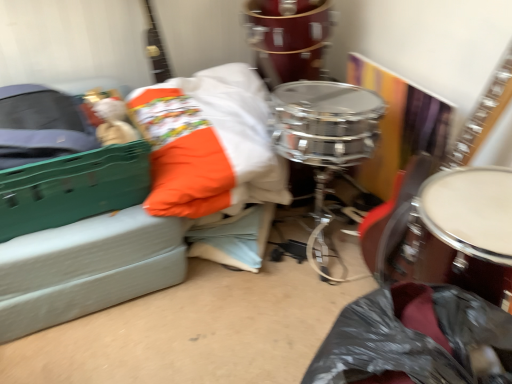
Describe the element at coordinates (458, 233) in the screenshot. I see `shiny brown drum at right, placed as the 1th drum when sorted from front to back` at that location.

This screenshot has width=512, height=384. I want to click on glossy wood guitar at upper left, the 2th guitar when ordered from right to left, so click(156, 48).

The image size is (512, 384). I want to click on shiny brown drum at right, acting as the 2th drum starting from the top, so click(458, 233).

From the image's perspective, is glossy wood guitar at upper left, the 2th guitar when ordered from right to left, positioned above or below shiny brown drum at right, the 1th drum from the bottom?

glossy wood guitar at upper left, the 2th guitar when ordered from right to left, is above shiny brown drum at right, the 1th drum from the bottom.

Considering the positions of objects glossy wood guitar at upper left, acting as the 1th guitar starting from the left, and shiny brown drum at right, placed as the 1th drum when sorted from front to back, in the image provided, who is more to the right, glossy wood guitar at upper left, acting as the 1th guitar starting from the left, or shiny brown drum at right, placed as the 1th drum when sorted from front to back,?

From the viewer's perspective, shiny brown drum at right, placed as the 1th drum when sorted from front to back, appears more on the right side.

Between glossy wood guitar at upper left, acting as the 1th guitar starting from the left, and shiny brown drum at right, the 1th drum from the bottom, which one has less height?

glossy wood guitar at upper left, acting as the 1th guitar starting from the left, is shorter.

Does point (157, 59) come closer to viewer compared to point (417, 224)?

That is False.

Is glossy wood guitar at upper left, the 2th guitar when ordered from right to left, with shiny chrome drum at center, which is the first drum in top-to-bottom order?

glossy wood guitar at upper left, the 2th guitar when ordered from right to left, and shiny chrome drum at center, which is the first drum in top-to-bottom order, are clearly separated.

Which point is more forward, (153, 68) or (291, 34)?

Point (291, 34)

Is glossy wood guitar at upper left, acting as the 1th guitar starting from the left, inside the boundaries of shiny chrome drum at center, placed as the 2th drum when sorted from front to back, or outside?

glossy wood guitar at upper left, acting as the 1th guitar starting from the left, is located beyond the bounds of shiny chrome drum at center, placed as the 2th drum when sorted from front to back.

Is wooden acoustic guitar at center right, which is counted as the 1th guitar, starting from the right, wider than shiny brown drum at right, the 1th drum from the bottom?

Incorrect, the width of wooden acoustic guitar at center right, which is counted as the 1th guitar, starting from the right, does not surpass that of shiny brown drum at right, the 1th drum from the bottom.

Does point (374, 262) lie behind point (498, 227)?

Yes, point (374, 262) is farther from viewer.

Is wooden acoustic guitar at center right, which is counted as the 1th guitar, starting from the right, turned away from shiny brown drum at right, the 1th drum from the bottom?

No, shiny brown drum at right, the 1th drum from the bottom, is not at the back of wooden acoustic guitar at center right, which is counted as the 1th guitar, starting from the right.

Is wooden acoustic guitar at center right, the 2th guitar positioned from the left, oriented away from shiny chrome drum at center, which is the first drum in top-to-bottom order?

No, wooden acoustic guitar at center right, the 2th guitar positioned from the left, is not facing the opposite direction of shiny chrome drum at center, which is the first drum in top-to-bottom order.

Considering the relative positions of wooden acoustic guitar at center right, which is counted as the 1th guitar, starting from the right, and shiny chrome drum at center, which is the second drum in bottom-to-top order, in the image provided, is wooden acoustic guitar at center right, which is counted as the 1th guitar, starting from the right, to the right of shiny chrome drum at center, which is the second drum in bottom-to-top order, from the viewer's perspective?

Indeed, wooden acoustic guitar at center right, which is counted as the 1th guitar, starting from the right, is positioned on the right side of shiny chrome drum at center, which is the second drum in bottom-to-top order.

How many degrees apart are the facing directions of wooden acoustic guitar at center right, the 2th guitar positioned from the left, and shiny chrome drum at center, which is the second drum in bottom-to-top order?

There is a 3.02-degree angle between the facing directions of wooden acoustic guitar at center right, the 2th guitar positioned from the left, and shiny chrome drum at center, which is the second drum in bottom-to-top order.

In the scene shown: Is there a large distance between wooden acoustic guitar at center right, the 2th guitar positioned from the left, and shiny chrome drum at center, which is the second drum in bottom-to-top order?

That's not correct — wooden acoustic guitar at center right, the 2th guitar positioned from the left, is a little close to shiny chrome drum at center, which is the second drum in bottom-to-top order.

Looking at this image, how many degrees apart are the facing directions of shiny brown drum at right, the 1th drum from the bottom, and glossy wood guitar at upper left, the 2th guitar when ordered from right to left?

The angle between the facing direction of shiny brown drum at right, the 1th drum from the bottom, and the facing direction of glossy wood guitar at upper left, the 2th guitar when ordered from right to left, is 87.6 degrees.

Is the position of shiny brown drum at right, the 2th drum viewed from the back, more distant than that of glossy wood guitar at upper left, acting as the 1th guitar starting from the left?

No, the depth of shiny brown drum at right, the 2th drum viewed from the back, is less than that of glossy wood guitar at upper left, acting as the 1th guitar starting from the left.

Which point is more forward, (424,213) or (152,27)?

Positioned in front is point (424,213).

From a real-world perspective, is shiny brown drum at right, acting as the 2th drum starting from the top, located beneath glossy wood guitar at upper left, acting as the 1th guitar starting from the left?

Yes.

Is point (154, 21) positioned before point (500, 96)?

No, (154, 21) is behind (500, 96).

Consider the image. Which object is thinner, glossy wood guitar at upper left, acting as the 1th guitar starting from the left, or wooden acoustic guitar at center right, which is counted as the 1th guitar, starting from the right?

Thinner between the two is wooden acoustic guitar at center right, which is counted as the 1th guitar, starting from the right.

From a real-world perspective, which is physically below, glossy wood guitar at upper left, acting as the 1th guitar starting from the left, or wooden acoustic guitar at center right, which is counted as the 1th guitar, starting from the right?

wooden acoustic guitar at center right, which is counted as the 1th guitar, starting from the right, from a real-world perspective.

Are glossy wood guitar at upper left, acting as the 1th guitar starting from the left, and wooden acoustic guitar at center right, the 2th guitar positioned from the left, far apart?

Absolutely, glossy wood guitar at upper left, acting as the 1th guitar starting from the left, is distant from wooden acoustic guitar at center right, the 2th guitar positioned from the left.

Which object is closer to the camera taking this photo, shiny chrome drum at center, which is the second drum in bottom-to-top order, or wooden acoustic guitar at center right, which is counted as the 1th guitar, starting from the right?

Positioned in front is wooden acoustic guitar at center right, which is counted as the 1th guitar, starting from the right.

Measure the distance between shiny chrome drum at center, which is the second drum in bottom-to-top order, and wooden acoustic guitar at center right, the 2th guitar positioned from the left.

A distance of 29.99 inches exists between shiny chrome drum at center, which is the second drum in bottom-to-top order, and wooden acoustic guitar at center right, the 2th guitar positioned from the left.

Do you think shiny chrome drum at center, the 1th drum viewed from the back, is within wooden acoustic guitar at center right, the 2th guitar positioned from the left, or outside of it?

shiny chrome drum at center, the 1th drum viewed from the back, is not enclosed by wooden acoustic guitar at center right, the 2th guitar positioned from the left.

Identify the location of guitar that is the 2nd object located below the shiny chrome drum at center, which is the first drum in top-to-bottom order (from the image's perspective). The height and width of the screenshot is (384, 512). (483, 114).

Locate an element on the screen. This screenshot has height=384, width=512. the 2nd drum to the right of the glossy wood guitar at upper left, acting as the 1th guitar starting from the left, counting from the anchor's position is located at coordinates (458, 233).

I want to click on drum above the glossy wood guitar at upper left, the 2th guitar when ordered from right to left (from the image's perspective), so click(288, 38).

When comparing their distances from wooden acoustic guitar at center right, the 2th guitar positioned from the left, does shiny chrome drum at center, which is the second drum in bottom-to-top order, or glossy wood guitar at upper left, the 2th guitar when ordered from right to left, seem further?

Among the two, glossy wood guitar at upper left, the 2th guitar when ordered from right to left, is located further to wooden acoustic guitar at center right, the 2th guitar positioned from the left.

Which object lies further to the anchor point shiny brown drum at right, the 1th drum from the bottom, shiny chrome drum at center, which is the second drum in bottom-to-top order, or glossy wood guitar at upper left, acting as the 1th guitar starting from the left?

glossy wood guitar at upper left, acting as the 1th guitar starting from the left.

From the image, which object appears to be nearer to shiny brown drum at right, placed as the 1th drum when sorted from front to back, wooden acoustic guitar at center right, which is counted as the 1th guitar, starting from the right, or glossy wood guitar at upper left, acting as the 1th guitar starting from the left?

Based on the image, wooden acoustic guitar at center right, which is counted as the 1th guitar, starting from the right, appears to be nearer to shiny brown drum at right, placed as the 1th drum when sorted from front to back.

When comparing their distances from glossy wood guitar at upper left, acting as the 1th guitar starting from the left, does shiny chrome drum at center, which is the second drum in bottom-to-top order, or shiny brown drum at right, acting as the 2th drum starting from the top, seem closer?

Based on the image, shiny chrome drum at center, which is the second drum in bottom-to-top order, appears to be nearer to glossy wood guitar at upper left, acting as the 1th guitar starting from the left.

From the picture: From the image, which object appears to be farther from wooden acoustic guitar at center right, which is counted as the 1th guitar, starting from the right, shiny brown drum at right, the 1th drum from the bottom, or shiny chrome drum at center, which is the second drum in bottom-to-top order?

Among the two, shiny chrome drum at center, which is the second drum in bottom-to-top order, is located further to wooden acoustic guitar at center right, which is counted as the 1th guitar, starting from the right.

Based on their spatial positions, is shiny brown drum at right, the 1th drum from the bottom, or glossy wood guitar at upper left, the 2th guitar when ordered from right to left, closer to wooden acoustic guitar at center right, which is counted as the 1th guitar, starting from the right?

shiny brown drum at right, the 1th drum from the bottom, lies closer to wooden acoustic guitar at center right, which is counted as the 1th guitar, starting from the right, than the other object.

Estimate the real-world distances between objects in this image. Which object is further from wooden acoustic guitar at center right, the 2th guitar positioned from the left, shiny chrome drum at center, which is the second drum in bottom-to-top order, or shiny brown drum at right, the 2th drum viewed from the back?

shiny chrome drum at center, which is the second drum in bottom-to-top order, is further to wooden acoustic guitar at center right, the 2th guitar positioned from the left.

When comparing their distances from shiny chrome drum at center, placed as the 2th drum when sorted from front to back, does glossy wood guitar at upper left, acting as the 1th guitar starting from the left, or shiny brown drum at right, placed as the 1th drum when sorted from front to back, seem closer?

glossy wood guitar at upper left, acting as the 1th guitar starting from the left.

The image size is (512, 384). I want to click on drum situated between glossy wood guitar at upper left, acting as the 1th guitar starting from the left, and shiny brown drum at right, placed as the 1th drum when sorted from front to back, from left to right, so click(x=288, y=38).

The image size is (512, 384). In order to click on guitar between glossy wood guitar at upper left, the 2th guitar when ordered from right to left, and shiny brown drum at right, the 2th drum viewed from the back, from left to right in this screenshot , I will do `click(483, 114)`.

Where is `drum between glossy wood guitar at upper left, acting as the 1th guitar starting from the left, and wooden acoustic guitar at center right, the 2th guitar positioned from the left, from left to right`? drum between glossy wood guitar at upper left, acting as the 1th guitar starting from the left, and wooden acoustic guitar at center right, the 2th guitar positioned from the left, from left to right is located at coordinates (288, 38).